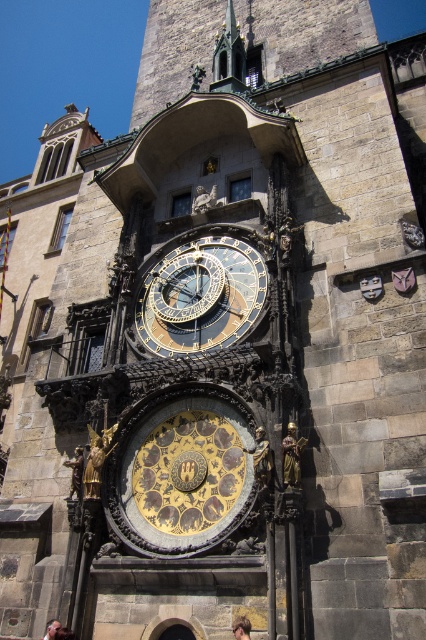
Question: Is goldmetallicclock at center to the right of golden hair at center from the viewer's perspective?

Choices:
 (A) no
 (B) yes

Answer: (A)

Question: Which point is farther from the camera taking this photo?

Choices:
 (A) (187, 436)
 (B) (242, 636)

Answer: (A)

Question: Which object is positioned closest to the light brown leather jacket at lower center?

Choices:
 (A) gold metallic clock at center
 (B) golden hair at center
 (C) goldmetallicclock at center

Answer: (B)

Question: Is gold metallic clock at center to the left of light brown leather jacket at lower center from the viewer's perspective?

Choices:
 (A) yes
 (B) no

Answer: (B)

Question: From the image, what is the correct spatial relationship of golden hair at center in relation to light brown leather jacket at lower center?

Choices:
 (A) below
 (B) above

Answer: (B)

Question: Which object is farther from the camera taking this photo?

Choices:
 (A) golden hair at center
 (B) light brown leather jacket at lower center

Answer: (B)